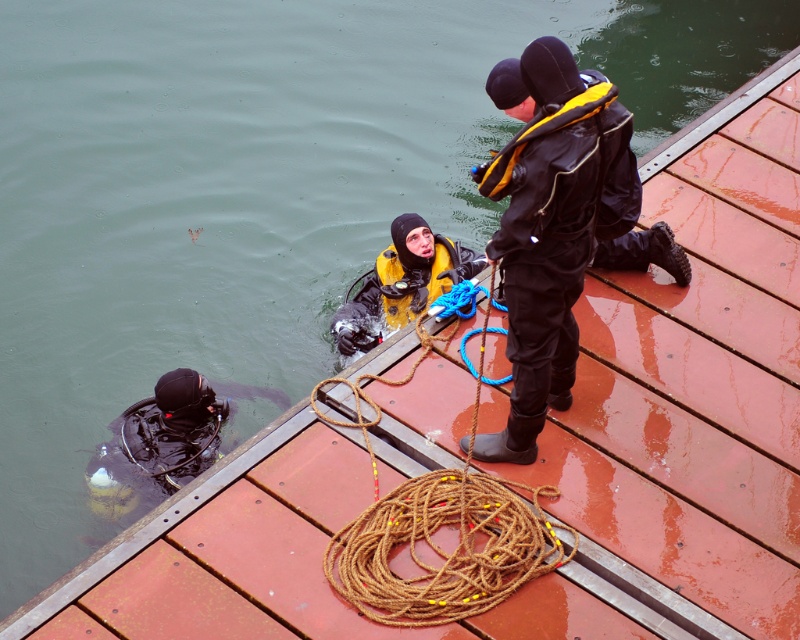
You are a photographer trying to capture the black matte wetsuit at upper right. The camera you are using has a focal point at point [560,230]. Will this point be on the wetsuit?

Yes, the point [560,230] is on the black matte wetsuit at upper right, so the focal point will be on the wetsuit.

You are a photographer positioned at the camera location. You want to take a photo of both point (550, 404) and point (509, 515). Which point is closer to your camera?

Point (550, 404) is further to the camera than point (509, 515), so the point closer to the camera is point (509, 515).

You are a safety officer checking the positioning of scuba divers in the image. The safety zone for divers is defined as the area within coordinates 0.6 to 0.7 on the x and y axes. Is the black matte diving suit at lower left positioned within this safety zone?

The black matte diving suit at lower left is at position coordinates point (x=156, y=444). The safety zone requires both x and y coordinates to be between 0.6 and 0.7. The x coordinate 0.695 is within the range, but the y coordinate 0.196 is below the minimum of 0.6. Therefore, the black matte diving suit at lower left is not positioned within the safety zone.